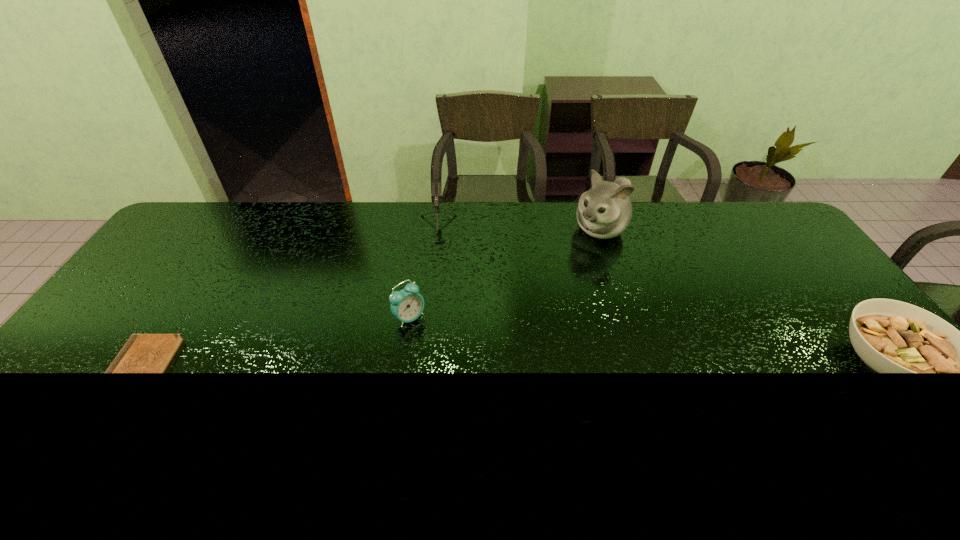
The height and width of the screenshot is (540, 960). What are the coordinates of `vacant area that lies between the microphone and the hamster` in the screenshot? It's located at (517, 231).

Image resolution: width=960 pixels, height=540 pixels. What are the coordinates of `vacant space that's between the leftmost object and the microphone` in the screenshot? It's located at (288, 300).

This screenshot has height=540, width=960. In order to click on free space between the shortest object and the tallest object in this screenshot , I will do `click(371, 299)`.

You are a GUI agent. You are given a task and a screenshot of the screen. Output one action in this format:
    pyautogui.click(x=<x>, y=<y>)
    Task: Click on the free space between the microphone and the alarm clock
    Image resolution: width=960 pixels, height=540 pixels.
    Given the screenshot: What is the action you would take?
    pyautogui.click(x=422, y=275)

Locate which object ranks in proximity to the microphone. Please provide its 2D coordinates. Your answer should be formatted as a tuple, i.e. [(x, y)], where the tuple contains the x and y coordinates of a point satisfying the conditions above.

[(407, 305)]

You are a GUI agent. You are given a task and a screenshot of the screen. Output one action in this format:
    pyautogui.click(x=<x>, y=<y>)
    Task: Click on the object that ranks as the second closest to the rightmost object
    
    Given the screenshot: What is the action you would take?
    pyautogui.click(x=436, y=186)

Identify the location of free space that satisfies the following two spatial constraints: 1. on the back side of the hamster; 2. on the left side of the microphone. (437, 230).

This screenshot has height=540, width=960. I want to click on blank space that satisfies the following two spatial constraints: 1. on the back side of the microphone; 2. on the right side of the alarm clock, so click(x=422, y=233).